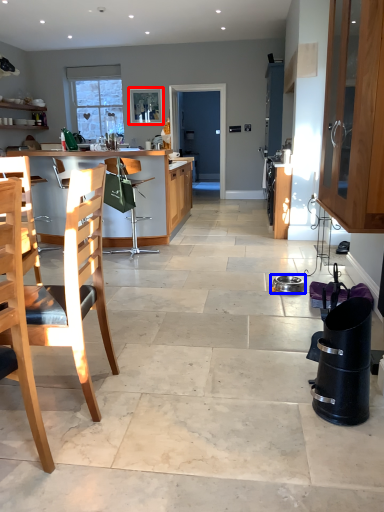
Question: Among these objects, which one is nearest to the camera, picture frame (highlighted by a red box) or appliance (highlighted by a blue box)?

Choices:
 (A) picture frame
 (B) appliance

Answer: (B)